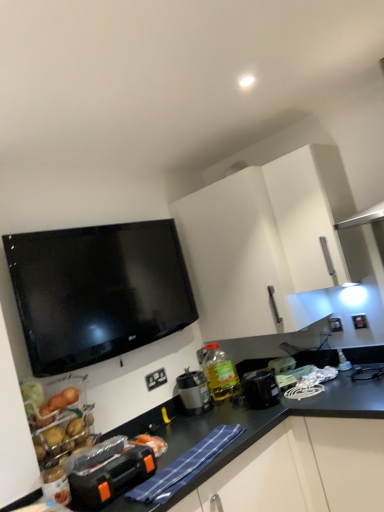
Question: Considering the positions of point (206, 410) and point (216, 394), is point (206, 410) closer or farther from the camera than point (216, 394)?

Choices:
 (A) closer
 (B) farther

Answer: (A)

Question: Looking at the image, does matte black coffee maker at center, which ranks as the third appliance in front-to-back order, seem bigger or smaller compared to translucent yellow bottle at center?

Choices:
 (A) big
 (B) small

Answer: (B)

Question: Based on their relative distances, which object is nearer to the white plastic electric outlet at upper right, the second electric outlet in the bottom-to-top sequence?

Choices:
 (A) white matte cabinet at upper center
 (B) white plastic electrical outlet at lower center, which is the second electric outlet in top-to-bottom order
 (C) black plastic toolbox at lower left, the 1th appliance from the left
 (D) matte black coffee maker at center, acting as the 3th appliance starting from the right
 (E) translucent yellow bottle at center

Answer: (A)

Question: Based on their relative distances, which object is nearer to the translucent yellow bottle at center?

Choices:
 (A) white plastic electrical outlet at lower center, which is the second electric outlet in top-to-bottom order
 (B) white plastic toaster at right, the 1th appliance from the back
 (C) white plastic electric outlet at upper right, the 1th electric outlet when ordered from right to left
 (D) matte black coffee maker at center, which ranks as the third appliance in front-to-back order
 (E) white matte cabinet at upper center

Answer: (D)